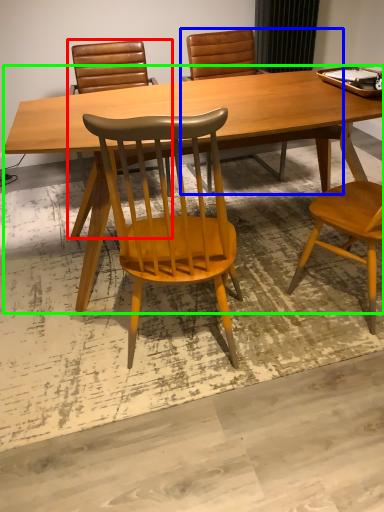
Question: Which object is the closest to the chair (highlighted by a red box)? Choose among these: chair (highlighted by a blue box) or desk (highlighted by a green box).

Choices:
 (A) chair
 (B) desk

Answer: (A)